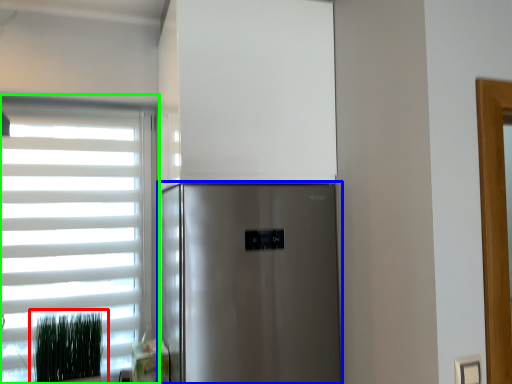
Question: Which object is positioned farthest from plant (highlighted by a red box)? Select from refrigerator (highlighted by a blue box) and window (highlighted by a green box).

Choices:
 (A) refrigerator
 (B) window

Answer: (A)